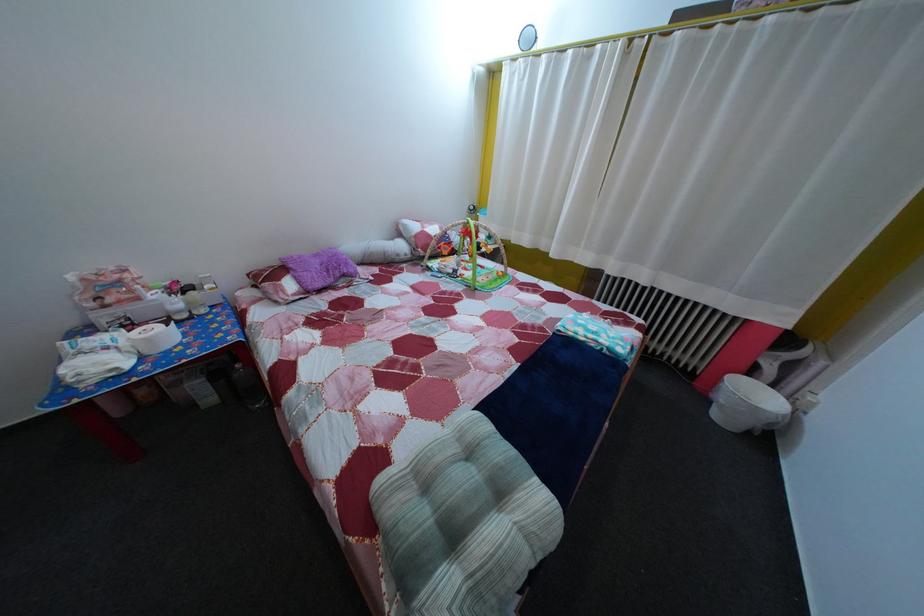
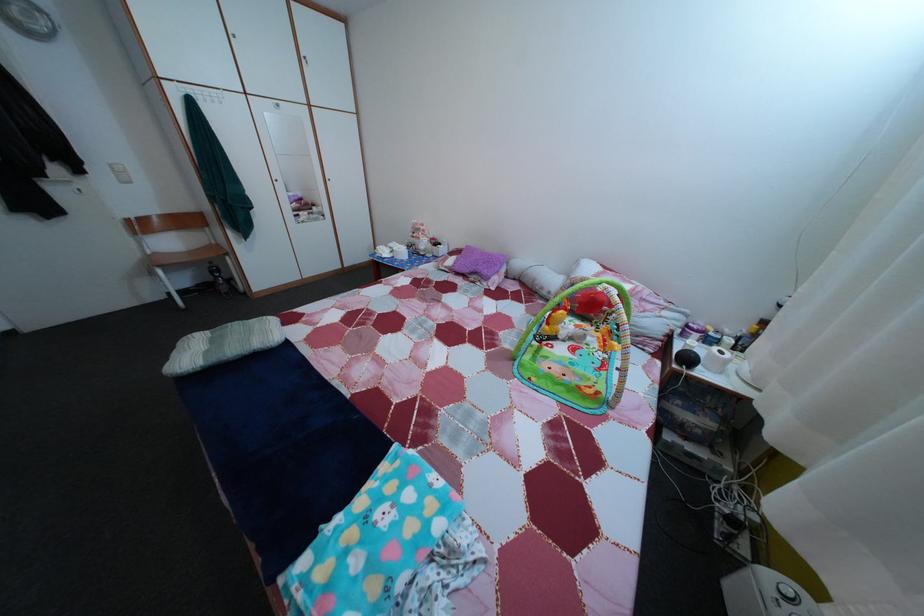
In the second image, find the point that corresponds to (325,262) in the first image.

(492, 261)